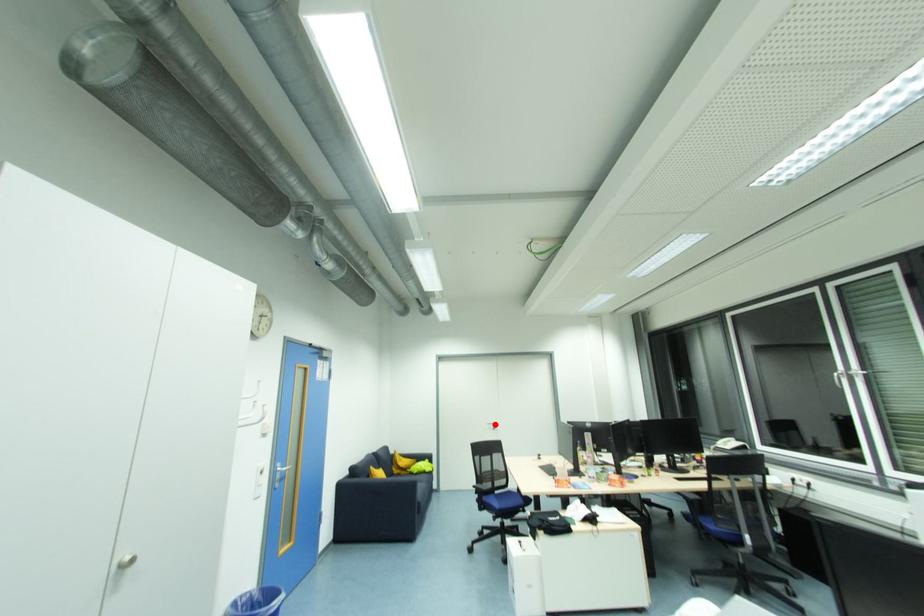
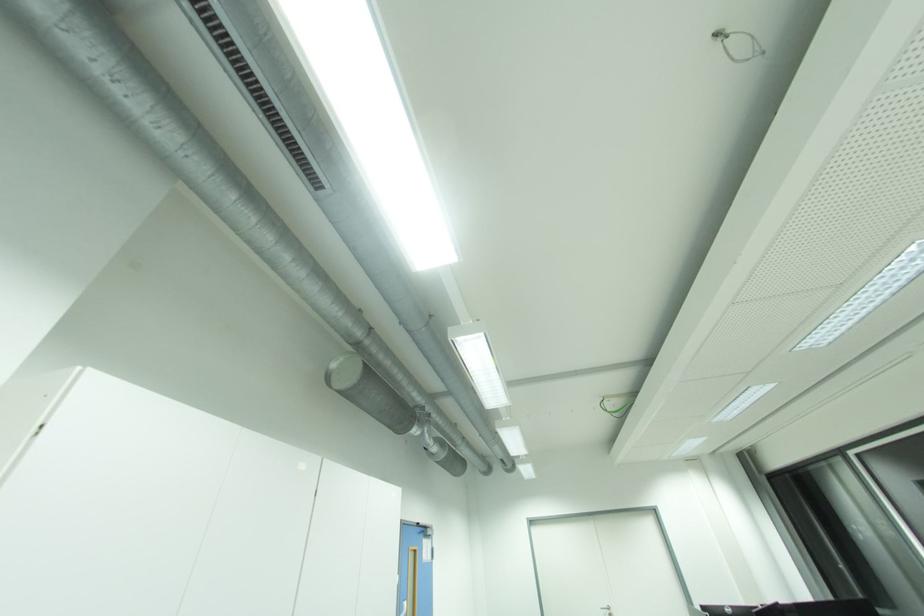
Locate, in the second image, the point that corresponds to the highlighted location in the first image.

(610, 609)